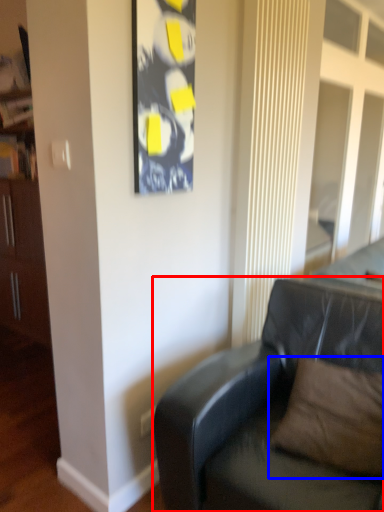
Question: Among these objects, which one is farthest to the camera, studio couch (highlighted by a red box) or pillow (highlighted by a blue box)?

Choices:
 (A) studio couch
 (B) pillow

Answer: (B)